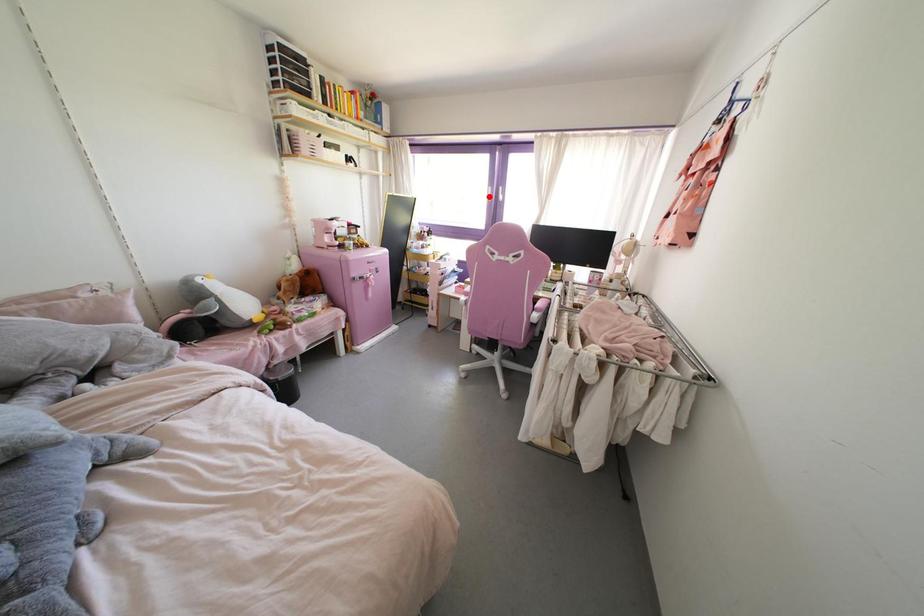
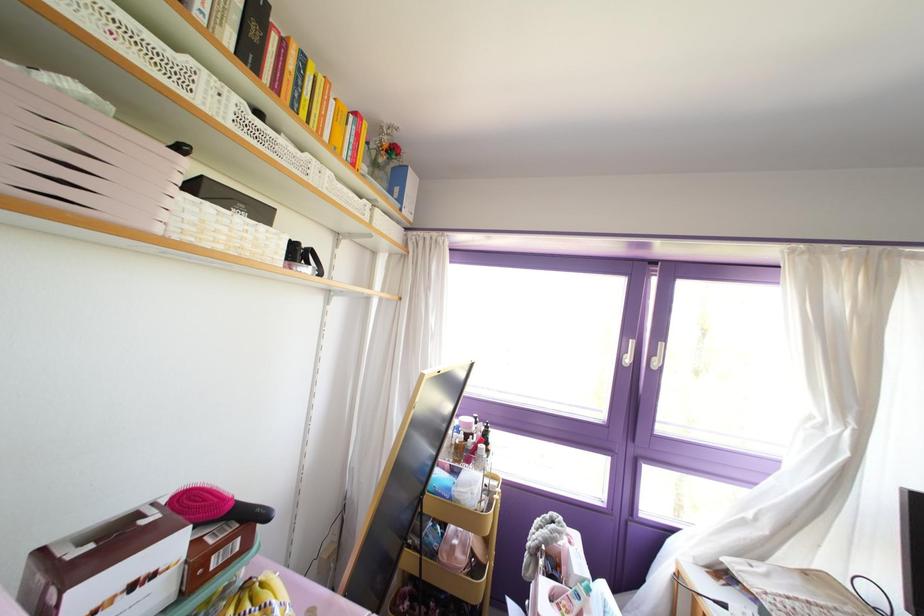
Question: I am providing you with two images of the same scene from different viewpoints. In image1, a red point is highlighted. Considering the same 3D point in image2, which of the following is correct?

Choices:
 (A) It is closer
 (B) It is farther

Answer: (B)